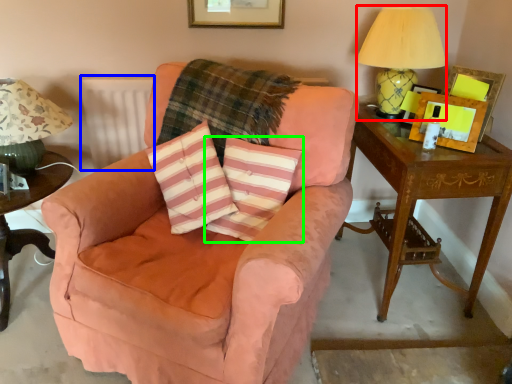
Question: Based on their relative distances, which object is farther from table lamp (highlighted by a red box)? Choose from radiator (highlighted by a blue box) and pillow (highlighted by a green box).

Choices:
 (A) radiator
 (B) pillow

Answer: (A)